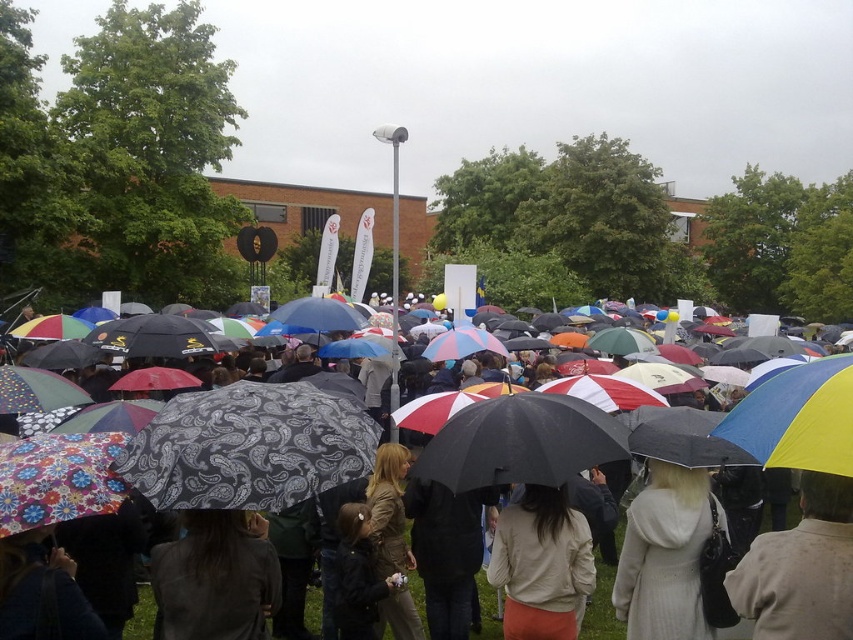
You are a photographer trying to capture a photo of the light beige sweater at lower right and the white wool coat at center. Since the scene is crowded, you need to adjust your camera angle. Which clothing item should you focus on first to ensure it doesn

The light beige sweater at lower right is shorter than the white wool coat at center. Therefore, you should focus on the light beige sweater at lower right first to ensure it is fully captured in the photo.